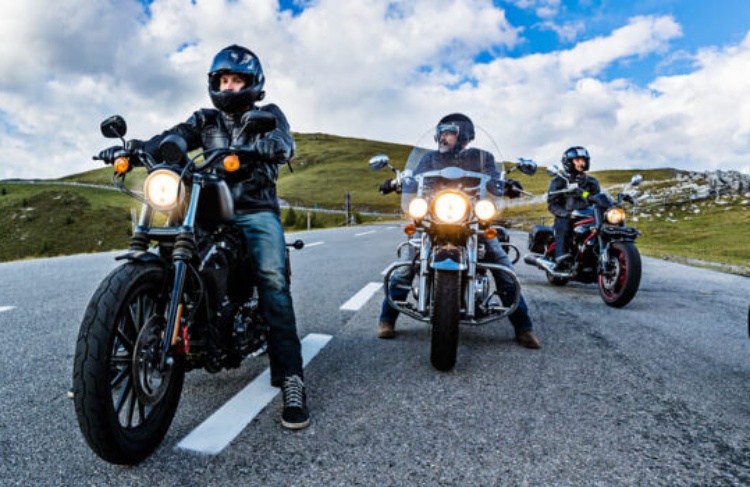
Identify the location of lights. (163, 192), (454, 206), (411, 204), (484, 214), (613, 216), (232, 160), (117, 164).